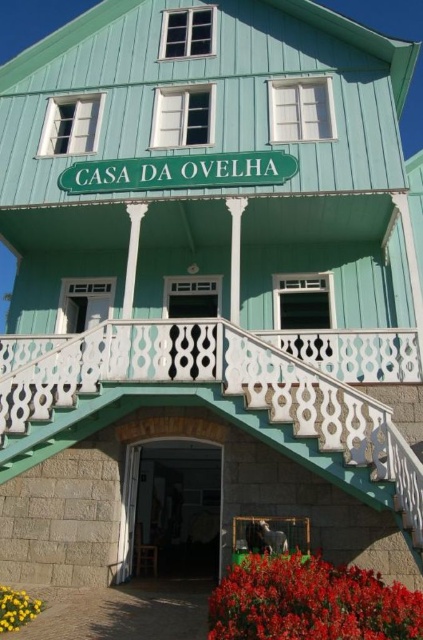
Which is above, vivid red petals at lower center or wooden door at center?

vivid red petals at lower center

Is vivid red petals at lower center behind wooden door at center?

No.

Describe the element at coordinates (310, 602) in the screenshot. This screenshot has height=640, width=423. I see `vivid red petals at lower center` at that location.

Find the location of a particular element. The image size is (423, 640). vivid red petals at lower center is located at coordinates (310, 602).

Does wooden door at center have a lesser height compared to yellow matte flower at lower left?

In fact, wooden door at center may be taller than yellow matte flower at lower left.

Between point (194, 512) and point (10, 605), which one is positioned behind?

The point (194, 512) is behind.

Which is in front, point (178, 541) or point (0, 611)?

Point (0, 611) is more forward.

In order to click on wooden door at center in this screenshot , I will do `click(172, 508)`.

Does point (360, 604) come closer to viewer compared to point (14, 628)?

That is True.

Is vivid red petals at lower center to the left of yellow matte flower at lower left from the viewer's perspective?

No, vivid red petals at lower center is not to the left of yellow matte flower at lower left.

Does point (392, 616) lie behind point (5, 604)?

No, (392, 616) is in front of (5, 604).

The height and width of the screenshot is (640, 423). Identify the location of vivid red petals at lower center. [x=310, y=602].